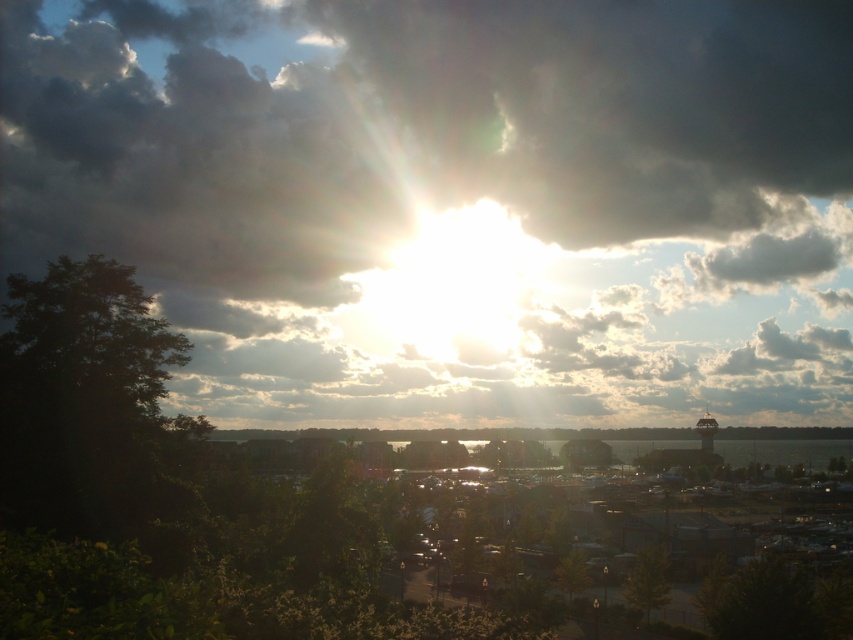
Based on the photo, you are a photographer trying to capture the sunset scene. You notice two trees in the foreground. The dark green leafy tree at left and the green matte tree at lower center. Which tree would block more of the sunset view if you stand between them?

The dark green leafy tree at left has a greater height compared to the green matte tree at lower center, so it would block more of the sunset view.

You are a photographer trying to capture the sunset. You have a camera with a 35mm lens and want to focus on the cloudy area at upper center located at point (453, 202). Given the scene description, where should you aim your camera to ensure the cloudy area at upper center is in the center of your frame?

The cloudy area at upper center is located at point (453, 202). Since this point is already at the upper center of the image, aiming the camera directly at that point will center the cloudy area in the frame.

You are standing at the center of the image and want to take a photo of the dark green leafy tree at left. In which direction should you move to get a better view of it?

The dark green leafy tree at left is located at point 0.630 on the x axis and 0.102 on the y axis. Since you are at the center, you should move to the left and down to get a better view of it.